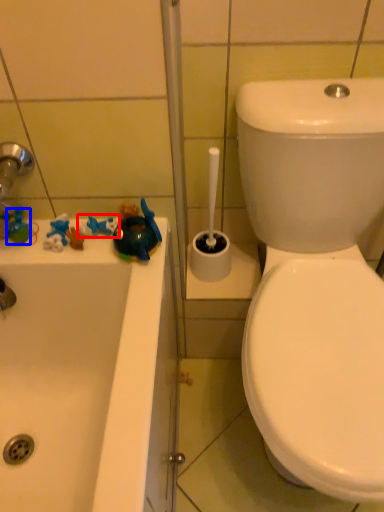
Question: Among these objects, which one is farthest to the camera, toy (highlighted by a red box) or toy (highlighted by a blue box)?

Choices:
 (A) toy
 (B) toy

Answer: (B)